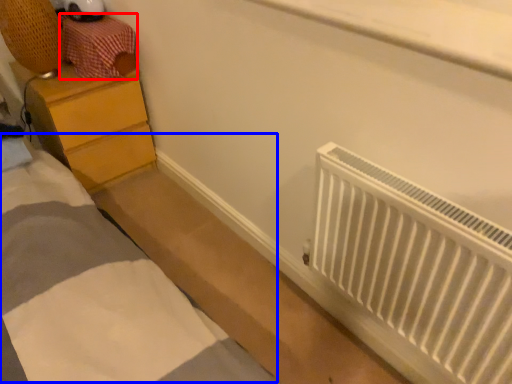
Question: Which of the following is the farthest to the observer, drawer (highlighted by a red box) or bed (highlighted by a blue box)?

Choices:
 (A) drawer
 (B) bed

Answer: (A)